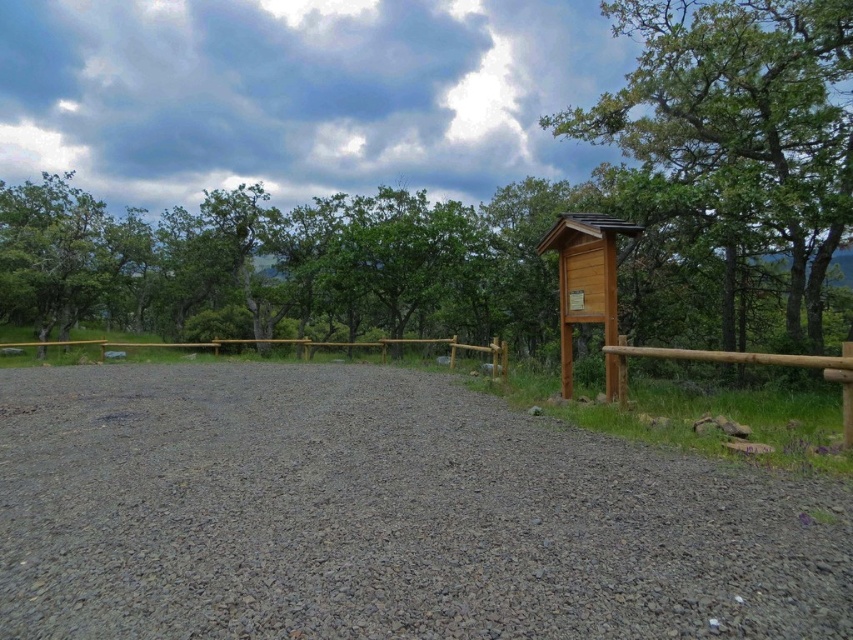
Does green wood sign at right have a lesser width compared to brown wooden fence at center?

Correct, green wood sign at right's width is less than brown wooden fence at center's.

Is green wood sign at right in front of brown wooden fence at center?

No, green wood sign at right is behind brown wooden fence at center.

Locate an element on the screen. green wood sign at right is located at coordinates (741, 124).

Can you confirm if gray gravel at center is positioned to the right of green wood sign at right?

No, gray gravel at center is not to the right of green wood sign at right.

Who is shorter, gray gravel at center or green wood sign at right?

With less height is gray gravel at center.

Is point (376, 502) behind point (740, 60)?

No, it is not.

Locate an element on the screen. The image size is (853, 640). gray gravel at center is located at coordinates (383, 515).

Between gray gravel at center and brown wooden fence at center, which one appears on the right side from the viewer's perspective?

gray gravel at center

Measure the distance between gray gravel at center and camera.

gray gravel at center is 2.69 meters away from camera.

Between point (154, 502) and point (91, 342), which one is positioned behind?

Positioned behind is point (91, 342).

You are a GUI agent. You are given a task and a screenshot of the screen. Output one action in this format:
    pyautogui.click(x=<x>, y=<y>)
    Task: Click on the gray gravel at center
    This screenshot has width=853, height=640.
    Given the screenshot: What is the action you would take?
    coord(383,515)